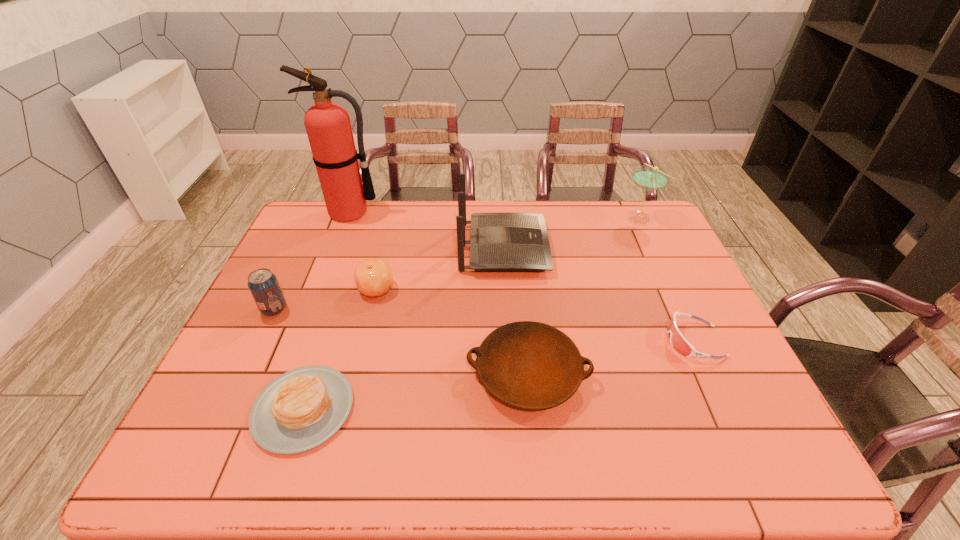
Find the location of a particular element. This screenshot has width=960, height=540. the tallest object is located at coordinates (328, 126).

Where is `router`? The width and height of the screenshot is (960, 540). router is located at coordinates (499, 242).

Where is `martini`? This screenshot has height=540, width=960. martini is located at coordinates (649, 178).

You are a GUI agent. You are given a task and a screenshot of the screen. Output one action in this format:
    pyautogui.click(x=<x>, y=<y>)
    Task: Click on the pop soda
    The image size is (960, 540).
    Given the screenshot: What is the action you would take?
    pyautogui.click(x=262, y=283)

Find the location of a particular element. the fourth shortest object is located at coordinates (373, 277).

What are the coordinates of `plate` in the screenshot? It's located at (528, 365).

The image size is (960, 540). Find the location of `goggles`. goggles is located at coordinates (679, 343).

Image resolution: width=960 pixels, height=540 pixels. Find the location of `pancake`. pancake is located at coordinates (299, 410).

In order to click on free space located at the nozzle of the fire extinguisher in this screenshot , I will do `click(319, 293)`.

The height and width of the screenshot is (540, 960). I want to click on free space located 0.160m on the front-facing side of the router, so click(597, 248).